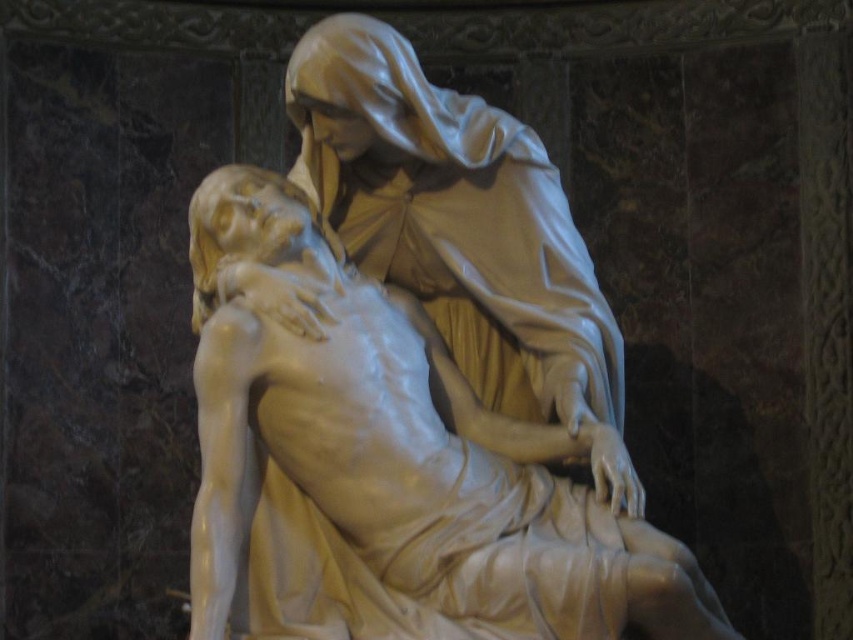
Can you confirm if white marble statue at center is shorter than matte white statue at center?

Yes.

Does white marble statue at center have a smaller size compared to matte white statue at center?

Indeed, white marble statue at center has a smaller size compared to matte white statue at center.

What do you see at coordinates (390, 465) in the screenshot? This screenshot has height=640, width=853. I see `white marble statue at center` at bounding box center [390, 465].

The image size is (853, 640). Identify the location of white marble statue at center. (390, 465).